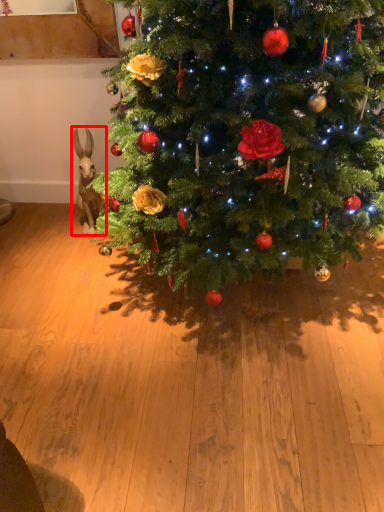
Question: From the image's perspective, considering the relative positions of animal (annotated by the red box) and christmas tree in the image provided, where is animal (annotated by the red box) located with respect to the staircase?

Choices:
 (A) above
 (B) below

Answer: (B)